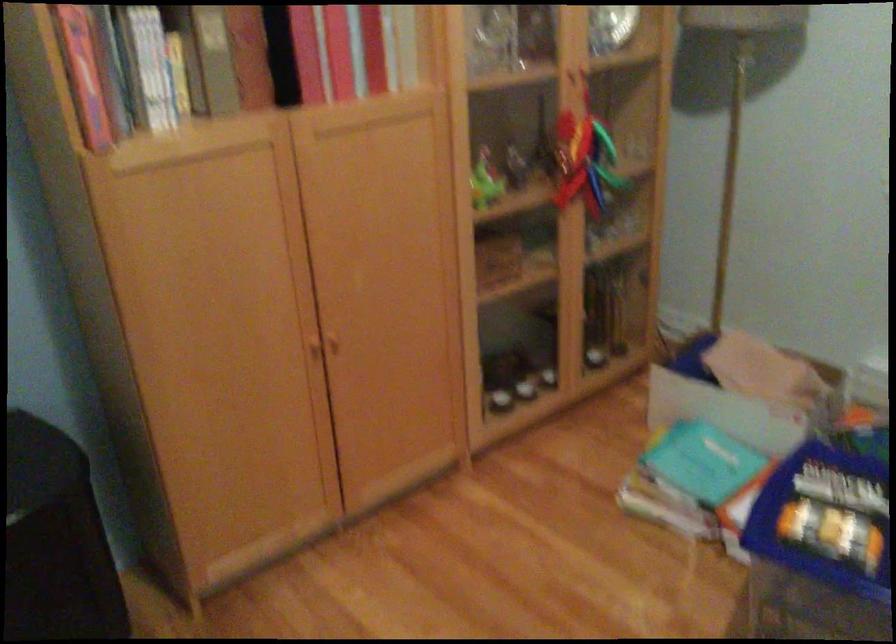
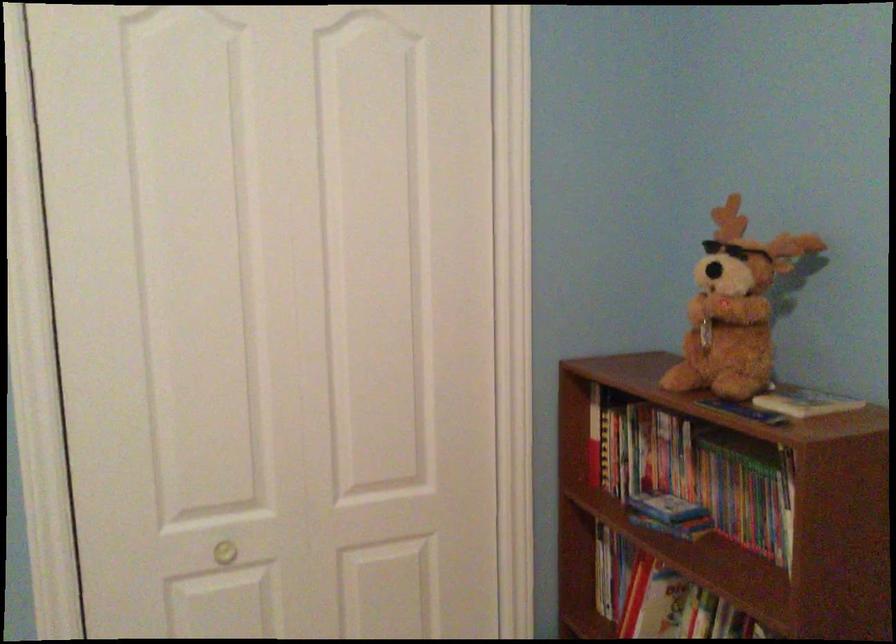
The first image is from the beginning of the video and the second image is from the end. How did the camera likely rotate when shooting the video?

The camera rotated toward left-down.